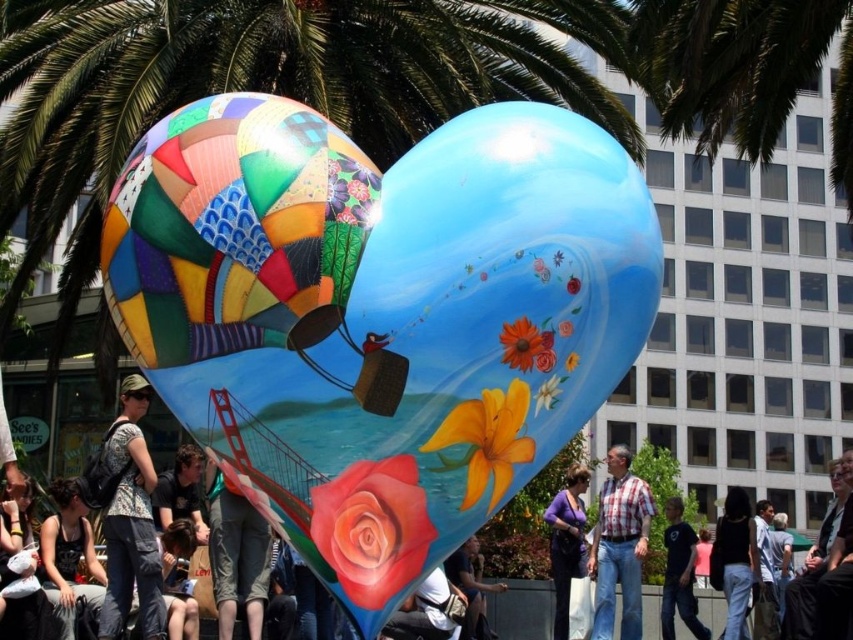
Can you confirm if green leafy palm tree at upper left is positioned above plaid shirt at center?

Indeed, green leafy palm tree at upper left is positioned over plaid shirt at center.

Does point (251, 13) come in front of point (616, 515)?

No, (251, 13) is behind (616, 515).

Image resolution: width=853 pixels, height=640 pixels. What are the coordinates of `green leafy palm tree at upper left` in the screenshot? It's located at (260, 88).

Is dark blue t-shirt at center thinner than denim jacket at lower center?

Indeed, dark blue t-shirt at center has a lesser width compared to denim jacket at lower center.

Can you confirm if dark blue t-shirt at center is taller than denim jacket at lower center?

No.

Which is in front, point (663, 609) or point (454, 572)?

Point (454, 572)

I want to click on dark blue t-shirt at center, so click(679, 573).

In the scene shown: Is green leafy palm tree at upper left behind purple fabric at center?

No, it is in front of purple fabric at center.

Measure the distance between green leafy palm tree at upper left and camera.

green leafy palm tree at upper left is 60.46 meters away from camera.

Image resolution: width=853 pixels, height=640 pixels. Identify the location of green leafy palm tree at upper left. (260, 88).